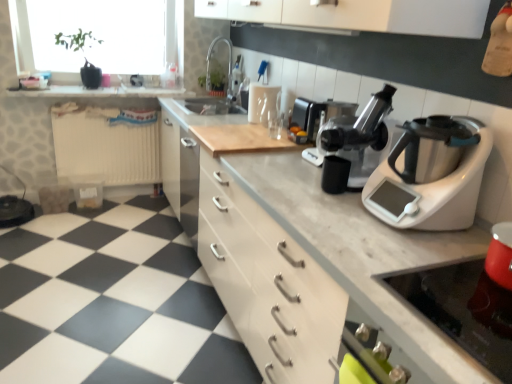
Question: Does metallic silver gas stove at lower right have a larger size compared to black plastic juicer at center?

Choices:
 (A) yes
 (B) no

Answer: (B)

Question: From the image's perspective, is metallic silver gas stove at lower right on black plastic juicer at center?

Choices:
 (A) yes
 (B) no

Answer: (B)

Question: Is metallic silver gas stove at lower right turned away from black plastic juicer at center?

Choices:
 (A) yes
 (B) no

Answer: (B)

Question: Considering the relative sizes of metallic silver gas stove at lower right and black plastic juicer at center in the image provided, is metallic silver gas stove at lower right smaller than black plastic juicer at center?

Choices:
 (A) no
 (B) yes

Answer: (B)

Question: From a real-world perspective, is metallic silver gas stove at lower right beneath black plastic juicer at center?

Choices:
 (A) no
 (B) yes

Answer: (B)

Question: Is metallic silver gas stove at lower right thinner than black plastic juicer at center?

Choices:
 (A) no
 (B) yes

Answer: (A)

Question: Is sleek silver coffee machine at center taller than silver metallic food processor at right?

Choices:
 (A) no
 (B) yes

Answer: (A)

Question: Can silver metallic food processor at right be found inside sleek silver coffee machine at center?

Choices:
 (A) no
 (B) yes

Answer: (A)

Question: Does sleek silver coffee machine at center appear on the right side of silver metallic food processor at right?

Choices:
 (A) no
 (B) yes

Answer: (A)

Question: Could you tell me if sleek silver coffee machine at center is turned towards silver metallic food processor at right?

Choices:
 (A) yes
 (B) no

Answer: (B)

Question: Is sleek silver coffee machine at center far from silver metallic food processor at right?

Choices:
 (A) yes
 (B) no

Answer: (B)

Question: Can you confirm if sleek silver coffee machine at center is wider than silver metallic food processor at right?

Choices:
 (A) yes
 (B) no

Answer: (B)

Question: From a real-world perspective, is matte silver sink at upper center under transparent glass window screen at upper left?

Choices:
 (A) yes
 (B) no

Answer: (A)